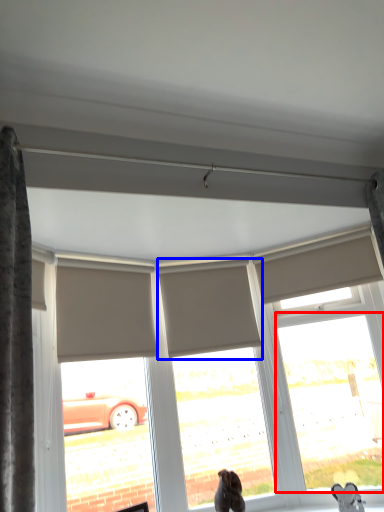
Question: Among these objects, which one is nearest to the camera, window (highlighted by a red box) or shutter (highlighted by a blue box)?

Choices:
 (A) window
 (B) shutter

Answer: (A)